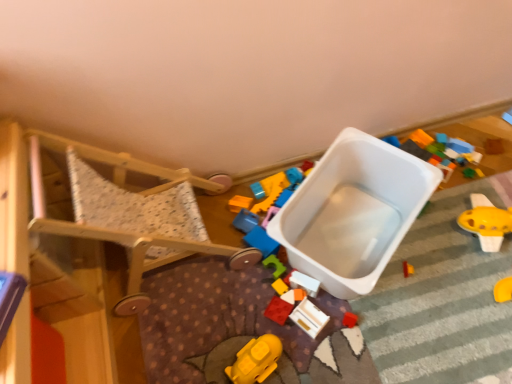
The width and height of the screenshot is (512, 384). I want to click on spots to the right of wooden toy at center, which appears as the fifth toy when viewed from the left, so click(367, 317).